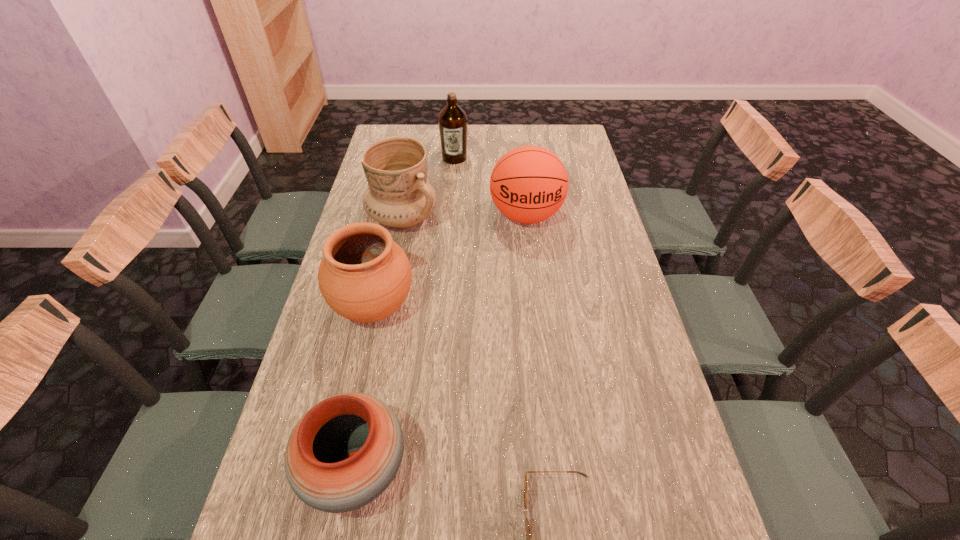
At what (x,y) coordinates should I click in order to perform the action: click on vacant region located 0.160m on the back of the nearest pottery. Please return your answer as a coordinate pair (x, y). Looking at the image, I should click on (377, 360).

The image size is (960, 540). What are the coordinates of `object present at the far edge` in the screenshot? It's located at (452, 121).

Where is `object located at the right edge`? object located at the right edge is located at coordinates (529, 184).

Where is `free space at the far edge of the desktop`? free space at the far edge of the desktop is located at coordinates (491, 126).

Find the location of a particular element. free region at the left edge is located at coordinates (326, 522).

This screenshot has height=540, width=960. I want to click on vacant space at the right edge of the desktop, so click(x=594, y=214).

Find the location of `vacant space at the far left corner of the desktop`. vacant space at the far left corner of the desktop is located at coordinates (416, 128).

The image size is (960, 540). In order to click on vacant space at the far right corner of the desktop in this screenshot , I will do `click(550, 149)`.

Image resolution: width=960 pixels, height=540 pixels. Identify the location of free space between the farthest pottery and the basketball. (465, 217).

Identify the location of unoccupied area between the basketball and the farthest pottery. (465, 217).